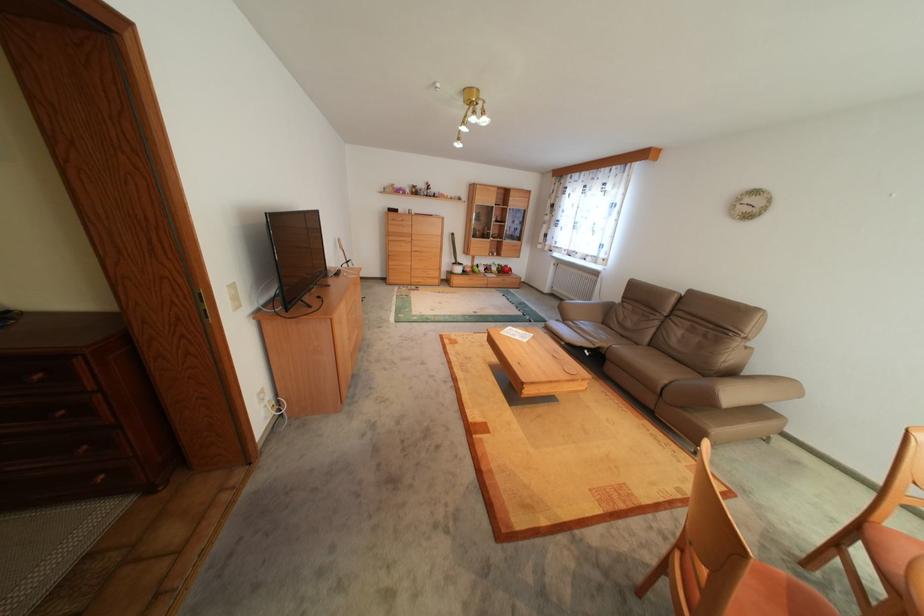
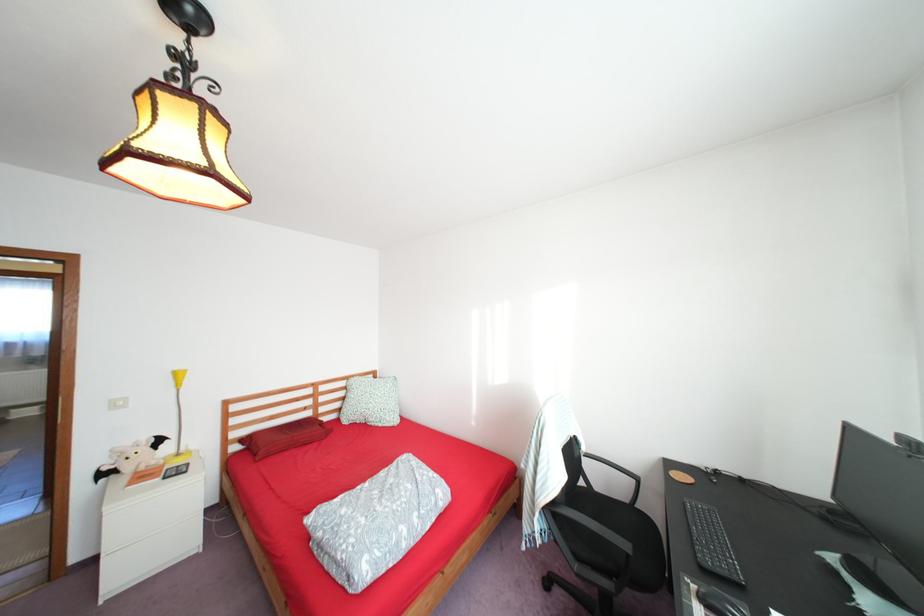
Question: I am providing you with two images of the same scene from different viewpoints. Which of the following objects are not visible in image2?

Choices:
 (A) ping-pong paddle
 (B) black chair armrest
 (C) brown sofa sitting surface
 (D) folded patterned blanket

Answer: (C)